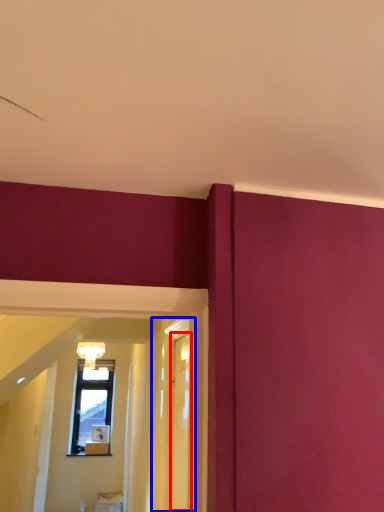
Question: Which object appears closest to the camera in this image, glass door (highlighted by a red box) or glass door (highlighted by a blue box)?

Choices:
 (A) glass door
 (B) glass door

Answer: (B)